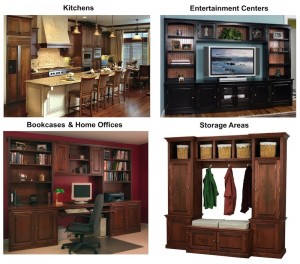
Locate an element on the screen. The image size is (300, 264). keyboard is located at coordinates (79, 210).